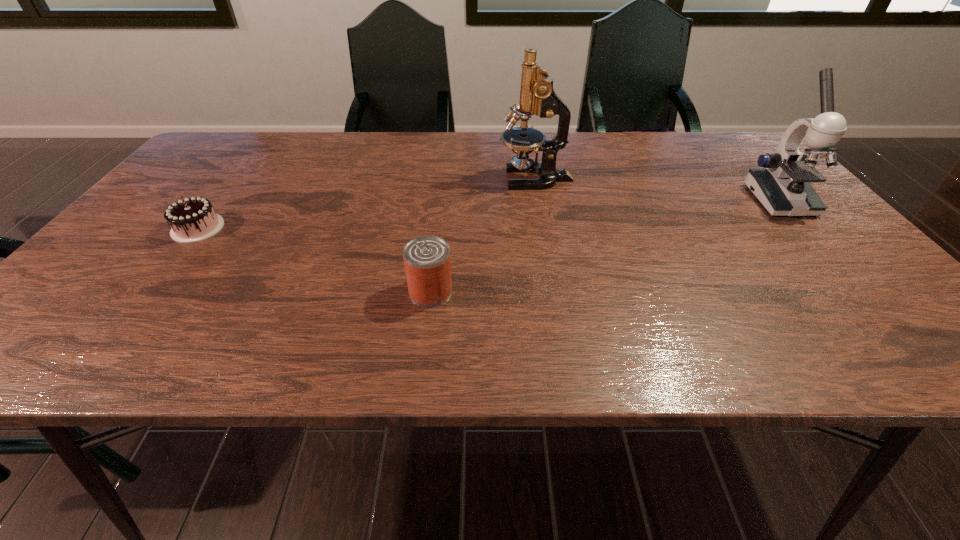
Locate an element on the screen. The height and width of the screenshot is (540, 960). free space that is in between the left microscope and the shortest object is located at coordinates (367, 203).

Select which object appears as the second closest to the second shortest object. Please provide its 2D coordinates. Your answer should be formatted as a tuple, i.e. [(x, y)], where the tuple contains the x and y coordinates of a point satisfying the conditions above.

[(194, 219)]

Choose which object is the nearest neighbor to the left microscope. Please provide its 2D coordinates. Your answer should be formatted as a tuple, i.e. [(x, y)], where the tuple contains the x and y coordinates of a point satisfying the conditions above.

[(427, 263)]

Identify the location of free space that satisfies the following two spatial constraints: 1. at the eyepiece of the left microscope; 2. on the front side of the third object from right to left. (555, 291).

What are the coordinates of `free spot that satisfies the following two spatial constraints: 1. at the eyepiece of the right microscope; 2. on the right side of the second object from right to left` in the screenshot? It's located at (540, 200).

At what (x,y) coordinates should I click in order to perform the action: click on free region that satisfies the following two spatial constraints: 1. at the eyepiece of the left microscope; 2. on the front side of the can. Please return your answer as a coordinate pair (x, y). Looking at the image, I should click on (555, 291).

The height and width of the screenshot is (540, 960). I want to click on vacant area that satisfies the following two spatial constraints: 1. on the back side of the rightmost object; 2. at the eyepiece of the left microscope, so click(760, 179).

Find the location of `vacant region that satisfies the following two spatial constraints: 1. on the front side of the second shortest object; 2. on the left side of the leftmost object`. vacant region that satisfies the following two spatial constraints: 1. on the front side of the second shortest object; 2. on the left side of the leftmost object is located at coordinates (149, 291).

Identify the location of vacant area that satisfies the following two spatial constraints: 1. at the eyepiece of the third object from left to right; 2. on the left side of the right microscope. (540, 200).